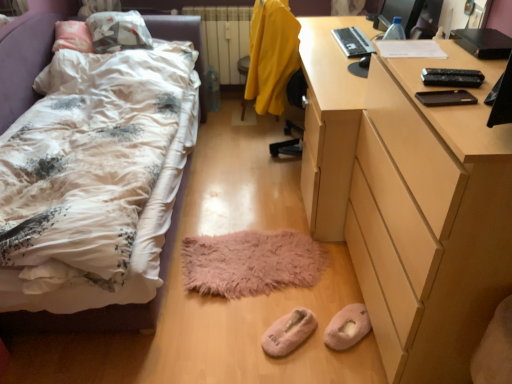
Question: Does light brown wooden desk at right touch yellow fabric swivel chair at center?

Choices:
 (A) no
 (B) yes

Answer: (A)

Question: Is light brown wooden desk at right to the left of yellow fabric swivel chair at center from the viewer's perspective?

Choices:
 (A) yes
 (B) no

Answer: (B)

Question: Is light brown wooden desk at right facing away from yellow fabric swivel chair at center?

Choices:
 (A) yes
 (B) no

Answer: (B)

Question: From the image's perspective, is light brown wooden desk at right under yellow fabric swivel chair at center?

Choices:
 (A) yes
 (B) no

Answer: (A)

Question: Is yellow fabric swivel chair at center located within light brown wooden desk at right?

Choices:
 (A) no
 (B) yes

Answer: (A)

Question: Considering the positions of black plastic laptop at upper right and white painted metal radiator at center in the image, is black plastic laptop at upper right wider or thinner than white painted metal radiator at center?

Choices:
 (A) wide
 (B) thin

Answer: (B)

Question: From the image's perspective, is black plastic laptop at upper right positioned above or below white painted metal radiator at center?

Choices:
 (A) below
 (B) above

Answer: (A)

Question: Looking at the image, does black plastic laptop at upper right seem bigger or smaller compared to white painted metal radiator at center?

Choices:
 (A) small
 (B) big

Answer: (A)

Question: In the image, is black plastic laptop at upper right on the left side or the right side of white painted metal radiator at center?

Choices:
 (A) left
 (B) right

Answer: (B)

Question: From a real-world perspective, relative to light brown wooden desk at right, is black plastic laptop at upper right vertically above or below?

Choices:
 (A) above
 (B) below

Answer: (A)

Question: Relative to light brown wooden desk at right, is black plastic laptop at upper right in front or behind?

Choices:
 (A) behind
 (B) front

Answer: (A)

Question: Which is correct: black plastic laptop at upper right is inside light brown wooden desk at right, or outside of it?

Choices:
 (A) inside
 (B) outside

Answer: (B)

Question: In terms of size, does black plastic laptop at upper right appear bigger or smaller than light brown wooden desk at right?

Choices:
 (A) big
 (B) small

Answer: (B)

Question: Is pink fluffy slippers at lower center, arranged as the 2th footwear when viewed from the right, inside or outside of pink fluffy slippers at lower center, acting as the 1th footwear starting from the right?

Choices:
 (A) inside
 (B) outside

Answer: (B)

Question: Looking at the image, does pink fluffy slippers at lower center, arranged as the 2th footwear when viewed from the right, seem bigger or smaller compared to pink fluffy slippers at lower center, acting as the 1th footwear starting from the right?

Choices:
 (A) small
 (B) big

Answer: (B)